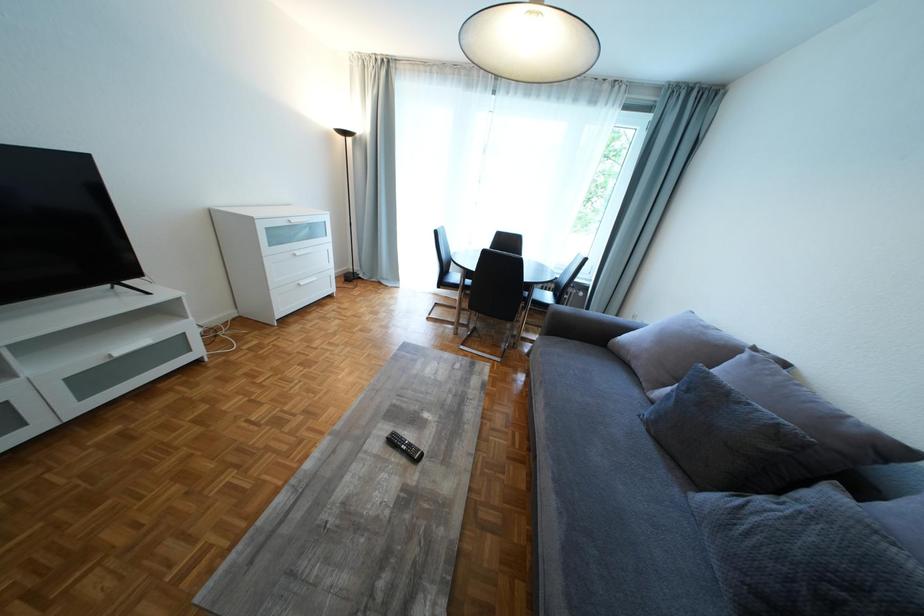
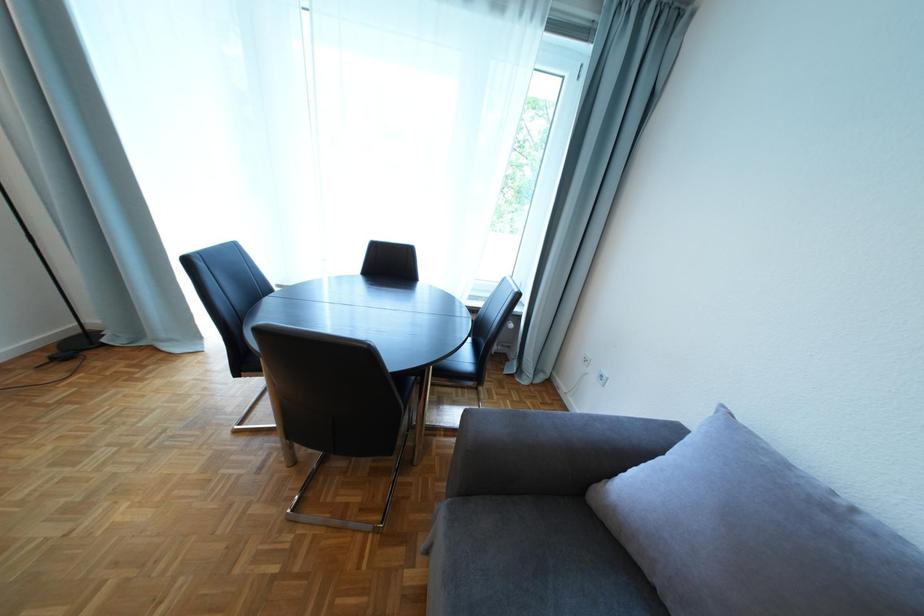
In a continuous first-person perspective shot, in which direction is the camera moving?

The movement direction of the cameraman is right, forward.